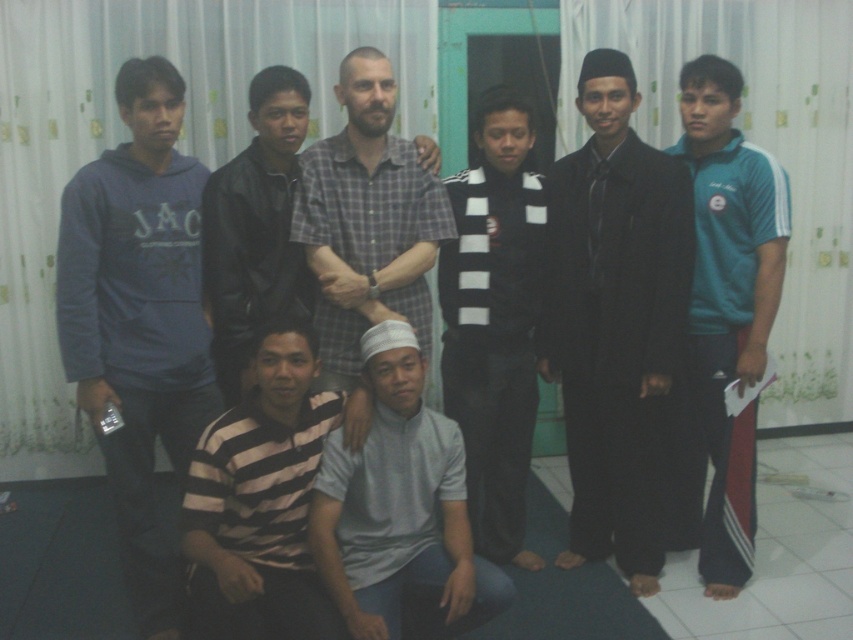
Looking at this image, who is positioned more to the left, matte blue hoodie at left or teal athletic wear at right?

From the viewer's perspective, matte blue hoodie at left appears more on the left side.

Between matte blue hoodie at left and teal athletic wear at right, which one has more height?

teal athletic wear at right is taller.

You are a GUI agent. You are given a task and a screenshot of the screen. Output one action in this format:
    pyautogui.click(x=<x>, y=<y>)
    Task: Click on the matte blue hoodie at left
    
    Given the screenshot: What is the action you would take?
    pyautogui.click(x=138, y=317)

Between point (621, 403) and point (347, 184), which one is positioned in front?

Point (347, 184)

Which is more to the right, black matte suit at center or plaid cotton shirt at center?

From the viewer's perspective, black matte suit at center appears more on the right side.

Does point (662, 221) come closer to viewer compared to point (306, 148)?

No, (662, 221) is behind (306, 148).

You are a GUI agent. You are given a task and a screenshot of the screen. Output one action in this format:
    pyautogui.click(x=<x>, y=<y>)
    Task: Click on the black matte suit at center
    This screenshot has height=640, width=853.
    Given the screenshot: What is the action you would take?
    pyautogui.click(x=616, y=321)

Is point (396, 508) closer to camera compared to point (358, 330)?

That is True.

Between point (440, 580) and point (345, 208), which one is positioned in front?

Positioned in front is point (440, 580).

Who is more forward, (x=440, y=502) or (x=354, y=387)?

Point (x=440, y=502) is more forward.

This screenshot has width=853, height=640. What are the coordinates of `gray matte shirt at center` in the screenshot? It's located at (398, 506).